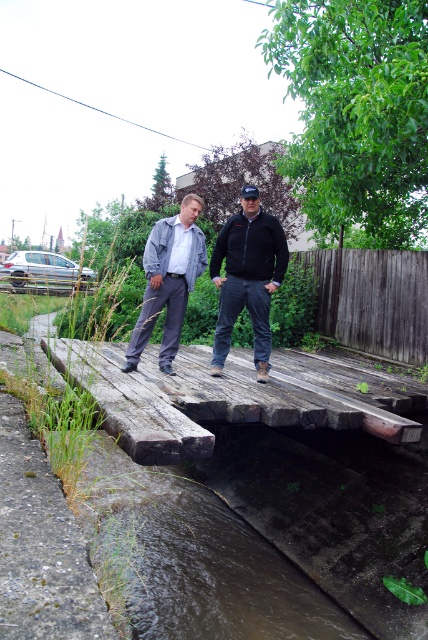
Can you confirm if weathered wood bridge at center is positioned to the left of matte gray jacket at center?

In fact, weathered wood bridge at center is to the right of matte gray jacket at center.

Is weathered wood bridge at center taller than matte gray jacket at center?

In fact, weathered wood bridge at center may be shorter than matte gray jacket at center.

Identify the location of weathered wood bridge at center. (231, 396).

Which is more to the right, brown concrete stream at lower center or black fleece jacket at center?

black fleece jacket at center is more to the right.

Can you confirm if brown concrete stream at lower center is thinner than black fleece jacket at center?

No, brown concrete stream at lower center is not thinner than black fleece jacket at center.

At what (x,y) coordinates should I click in order to perform the action: click on brown concrete stream at lower center. Please return your answer as a coordinate pair (x, y). Image resolution: width=428 pixels, height=640 pixels. Looking at the image, I should click on (219, 573).

Locate an element on the screen. brown concrete stream at lower center is located at coordinates (219, 573).

Does weathered wood bridge at center have a lesser height compared to matte black jacket at center?

Indeed, weathered wood bridge at center has a lesser height compared to matte black jacket at center.

Who is positioned more to the right, weathered wood bridge at center or matte black jacket at center?

weathered wood bridge at center is more to the right.

The width and height of the screenshot is (428, 640). I want to click on weathered wood bridge at center, so tap(231, 396).

Locate an element on the screen. The width and height of the screenshot is (428, 640). weathered wood bridge at center is located at coordinates (231, 396).